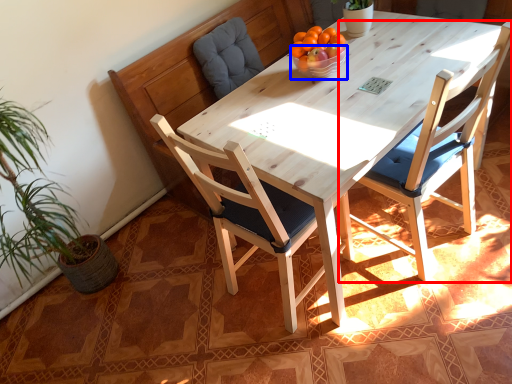
Question: Which point is further to the camera, chair (highlighted by a red box) or bowl (highlighted by a blue box)?

Choices:
 (A) chair
 (B) bowl

Answer: (B)